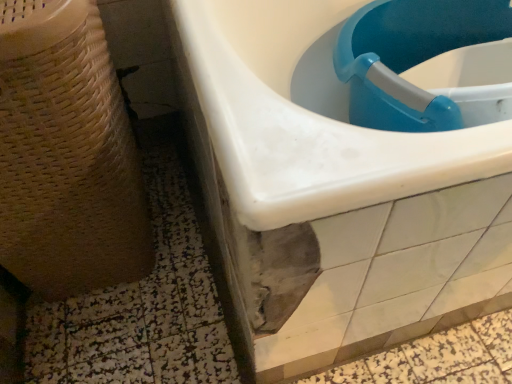
Find the location of a particular element. The image size is (512, 384). beige woven basket at left is located at coordinates (66, 154).

What do you see at coordinates (307, 120) in the screenshot? I see `blue plastic sink at upper right, marked as the 2th sink in a right-to-left arrangement` at bounding box center [307, 120].

Image resolution: width=512 pixels, height=384 pixels. Identify the location of beige woven basket at left. (66, 154).

Looking at this image, which is behind, blue plastic sink at upper right, marked as the 2th sink in a right-to-left arrangement, or blue plastic sink at upper right, the first sink positioned from the right?

Positioned behind is blue plastic sink at upper right, marked as the 2th sink in a right-to-left arrangement.

Looking at their sizes, would you say blue plastic sink at upper right, marked as the 2th sink in a right-to-left arrangement, is wider or thinner than blue plastic sink at upper right, the first sink positioned from the right?

blue plastic sink at upper right, marked as the 2th sink in a right-to-left arrangement, is wider than blue plastic sink at upper right, the first sink positioned from the right.

Does point (473, 166) come behind point (386, 20)?

That is False.

At what (x,y) coordinates should I click in order to perform the action: click on sink that is in front of the blue plastic sink at upper right, which is the first sink in left-to-right order. Please return your answer as a coordinate pair (x, y). Looking at the image, I should click on pyautogui.click(x=410, y=57).

Who is shorter, beige woven basket at left or blue plastic sink at upper right, marked as the 2th sink in a left-to-right arrangement?

blue plastic sink at upper right, marked as the 2th sink in a left-to-right arrangement, is shorter.

Is beige woven basket at left positioned with its back to blue plastic sink at upper right, marked as the 2th sink in a left-to-right arrangement?

That's not correct — beige woven basket at left is not looking away from blue plastic sink at upper right, marked as the 2th sink in a left-to-right arrangement.

From the image's perspective, is beige woven basket at left located beneath blue plastic sink at upper right, marked as the 2th sink in a left-to-right arrangement?

Yes, from the image's perspective, beige woven basket at left is beneath blue plastic sink at upper right, marked as the 2th sink in a left-to-right arrangement.

Between beige woven basket at left and blue plastic sink at upper right, the first sink positioned from the right, which one has smaller size?

blue plastic sink at upper right, the first sink positioned from the right, is smaller.

Which object is closer to the camera, blue plastic sink at upper right, marked as the 2th sink in a left-to-right arrangement, or beige woven basket at left?

beige woven basket at left.

Could you tell me if blue plastic sink at upper right, marked as the 2th sink in a left-to-right arrangement, is facing beige woven basket at left?

No, blue plastic sink at upper right, marked as the 2th sink in a left-to-right arrangement, is not turned towards beige woven basket at left.

Consider the image. Are blue plastic sink at upper right, marked as the 2th sink in a left-to-right arrangement, and beige woven basket at left far apart?

That's not correct — blue plastic sink at upper right, marked as the 2th sink in a left-to-right arrangement, is a little close to beige woven basket at left.

At what (x,y) coordinates should I click in order to perform the action: click on sink above the blue plastic sink at upper right, marked as the 2th sink in a right-to-left arrangement (from a real-world perspective). Please return your answer as a coordinate pair (x, y). The width and height of the screenshot is (512, 384). Looking at the image, I should click on (410, 57).

In the scene shown: Can you tell me how much blue plastic sink at upper right, marked as the 2th sink in a left-to-right arrangement, and blue plastic sink at upper right, marked as the 2th sink in a right-to-left arrangement, differ in facing direction?

blue plastic sink at upper right, marked as the 2th sink in a left-to-right arrangement, and blue plastic sink at upper right, marked as the 2th sink in a right-to-left arrangement, are facing 27 degrees away from each other.

Between blue plastic sink at upper right, marked as the 2th sink in a left-to-right arrangement, and blue plastic sink at upper right, marked as the 2th sink in a right-to-left arrangement, which one appears on the left side from the viewer's perspective?

From the viewer's perspective, blue plastic sink at upper right, marked as the 2th sink in a right-to-left arrangement, appears more on the left side.

Considering the positions of point (132, 246) and point (494, 167), is point (132, 246) closer or farther from the camera than point (494, 167)?

Point (132, 246) is farther from the camera than point (494, 167).

Where is `the 2nd sink behind the beige woven basket at left, counting from the anchor's position`? the 2nd sink behind the beige woven basket at left, counting from the anchor's position is located at coordinates pos(307,120).

Is beige woven basket at left oriented towards blue plastic sink at upper right, marked as the 2th sink in a right-to-left arrangement?

Yes, beige woven basket at left is turned towards blue plastic sink at upper right, marked as the 2th sink in a right-to-left arrangement.

Based on their positions, is beige woven basket at left located to the left or right of blue plastic sink at upper right, marked as the 2th sink in a right-to-left arrangement?

Clearly, beige woven basket at left is on the left of blue plastic sink at upper right, marked as the 2th sink in a right-to-left arrangement, in the image.

From the image's perspective, between blue plastic sink at upper right, which is the first sink in left-to-right order, and beige woven basket at left, which one is located above?

blue plastic sink at upper right, which is the first sink in left-to-right order, appears higher in the image.

Based on the photo, which point is more distant from viewer, (211, 103) or (13, 68)?

Positioned behind is point (211, 103).

From a real-world perspective, is blue plastic sink at upper right, marked as the 2th sink in a right-to-left arrangement, positioned above or below beige woven basket at left?

In terms of real-world spatial position, blue plastic sink at upper right, marked as the 2th sink in a right-to-left arrangement, is below beige woven basket at left.

Does blue plastic sink at upper right, marked as the 2th sink in a right-to-left arrangement, come behind beige woven basket at left?

Yes, it is behind beige woven basket at left.

I want to click on sink that is below the blue plastic sink at upper right, which is the first sink in left-to-right order (from the image's perspective), so click(x=410, y=57).

Locate an element on the screen. potty to the left of blue plastic sink at upper right, the first sink positioned from the right is located at coordinates [66, 154].

Looking at the image, which one is located further to blue plastic sink at upper right, the first sink positioned from the right, blue plastic sink at upper right, which is the first sink in left-to-right order, or beige woven basket at left?

Among the two, beige woven basket at left is located further to blue plastic sink at upper right, the first sink positioned from the right.

When comparing their distances from blue plastic sink at upper right, which is the first sink in left-to-right order, does beige woven basket at left or blue plastic sink at upper right, the first sink positioned from the right, seem further?

beige woven basket at left is further to blue plastic sink at upper right, which is the first sink in left-to-right order.

Considering their positions, is beige woven basket at left positioned closer to blue plastic sink at upper right, the first sink positioned from the right, than blue plastic sink at upper right, which is the first sink in left-to-right order?

blue plastic sink at upper right, which is the first sink in left-to-right order, is closer to blue plastic sink at upper right, the first sink positioned from the right.

Based on their spatial positions, is blue plastic sink at upper right, the first sink positioned from the right, or blue plastic sink at upper right, marked as the 2th sink in a right-to-left arrangement, closer to beige woven basket at left?

Among the two, blue plastic sink at upper right, marked as the 2th sink in a right-to-left arrangement, is located nearer to beige woven basket at left.

Looking at the image, which one is located further to beige woven basket at left, blue plastic sink at upper right, marked as the 2th sink in a right-to-left arrangement, or blue plastic sink at upper right, marked as the 2th sink in a left-to-right arrangement?

blue plastic sink at upper right, marked as the 2th sink in a left-to-right arrangement, is further to beige woven basket at left.

When comparing their distances from blue plastic sink at upper right, which is the first sink in left-to-right order, does blue plastic sink at upper right, the first sink positioned from the right, or beige woven basket at left seem further?

beige woven basket at left.

Find the location of a particular element. sink between beige woven basket at left and blue plastic sink at upper right, marked as the 2th sink in a left-to-right arrangement, in the horizontal direction is located at coordinates (307, 120).